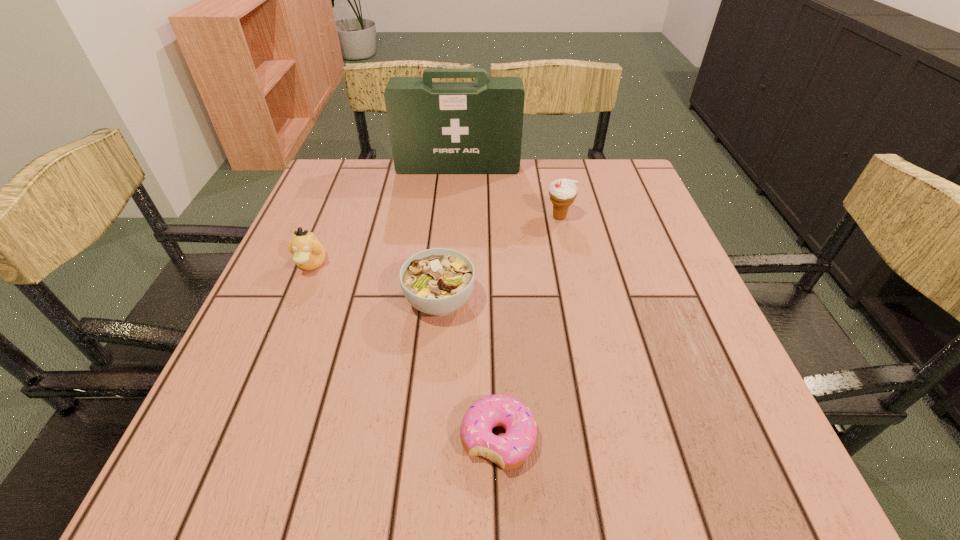
You are a GUI agent. You are given a task and a screenshot of the screen. Output one action in this format:
    pyautogui.click(x=<x>, y=<y>)
    Task: Click on the free region at the right edge of the desktop
    The image size is (960, 540).
    Given the screenshot: What is the action you would take?
    pyautogui.click(x=648, y=252)

In the image, there is a desktop. Where is `free region at the far left corner`? This screenshot has width=960, height=540. free region at the far left corner is located at coordinates (324, 187).

At what (x,y) coordinates should I click in order to perform the action: click on vacant space at the far right corner. Please return your answer as a coordinate pair (x, y). Image resolution: width=960 pixels, height=540 pixels. Looking at the image, I should click on point(612,185).

Where is `vacant space at the near right corner of the desktop`? This screenshot has width=960, height=540. vacant space at the near right corner of the desktop is located at coordinates (730, 442).

The image size is (960, 540). What are the coordinates of `free space between the fourth nearest object and the doughnut` in the screenshot? It's located at (529, 328).

Find the location of a particular element. Image resolution: width=960 pixels, height=540 pixels. free spot between the fourth shortest object and the shortest object is located at coordinates (529, 328).

This screenshot has height=540, width=960. Identify the location of free spot between the icecream and the fourth tallest object. (499, 259).

The image size is (960, 540). I want to click on free area in between the soup bowl and the duckling, so click(375, 282).

At what (x,y) coordinates should I click in order to perform the action: click on vacant space that is in between the second farthest object and the doughnut. Please return your answer as a coordinate pair (x, y). The image size is (960, 540). Looking at the image, I should click on (529, 328).

Image resolution: width=960 pixels, height=540 pixels. I want to click on blank region between the tallest object and the fourth shortest object, so click(x=509, y=192).